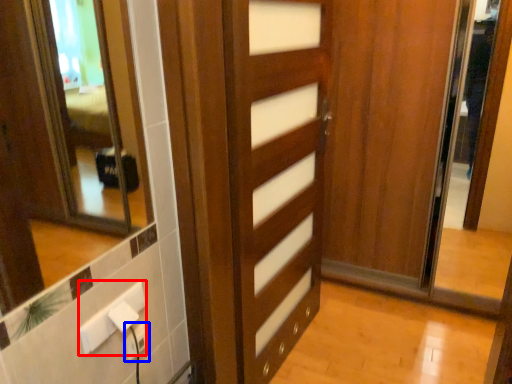
Question: Which point is closer to the camera, electric outlet (highlighted by a red box) or electric outlet (highlighted by a blue box)?

Choices:
 (A) electric outlet
 (B) electric outlet

Answer: (A)